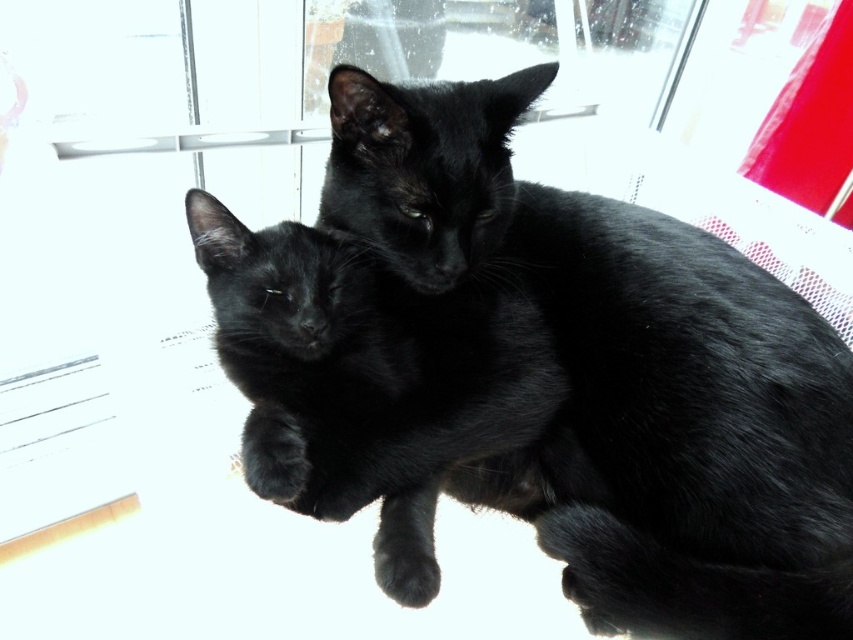
Between point (776, 346) and point (251, 408), which one is positioned in front?

Point (776, 346) is more forward.

Find the location of `black fur cat at center`. black fur cat at center is located at coordinates (563, 410).